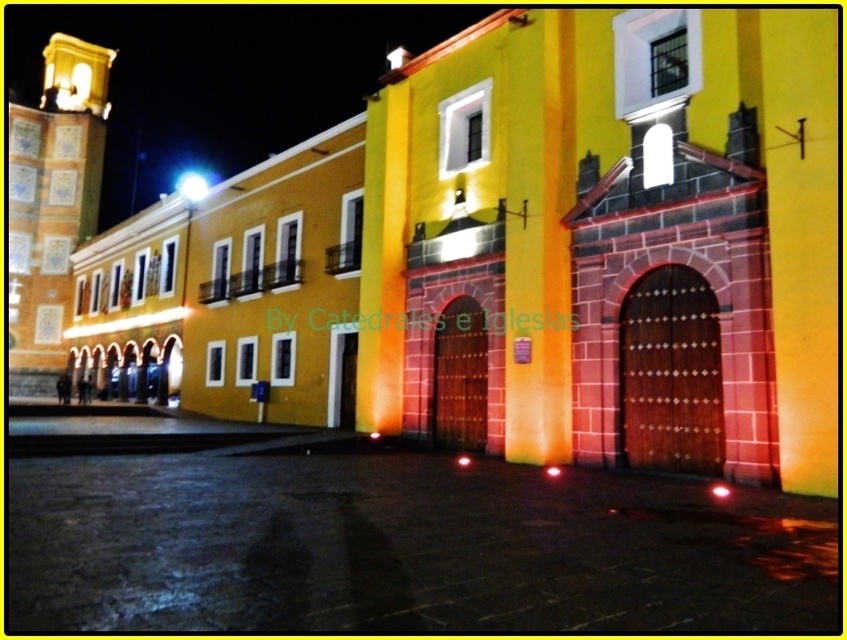
You are standing in front of the yellow building at night. There are two points marked on the building. The first point is at coordinates point (579, 124) and the second is at point (51, 292). From your perspective, which point appears closer to you?

Point (579, 124) is in front of point (51, 292), so it appears closer to you.

You are standing at the entrance of the matte yellow church at center. If you walk straight ahead, will you eventually reach the bell tower?

The bell tower is part of the matte yellow church at center, so walking straight ahead from the entrance would lead towards the bell tower located on the left side of the building.

You are standing in front of the building and want to take a photo of both the matte yellow church at center and the golden mosaic tile bell tower at left. Which object should you focus on first if you want to capture both in a single frame without moving your camera?

The matte yellow church at center is below the golden mosaic tile bell tower at left, so you should focus on the golden mosaic tile bell tower at left first to ensure both are in the frame.